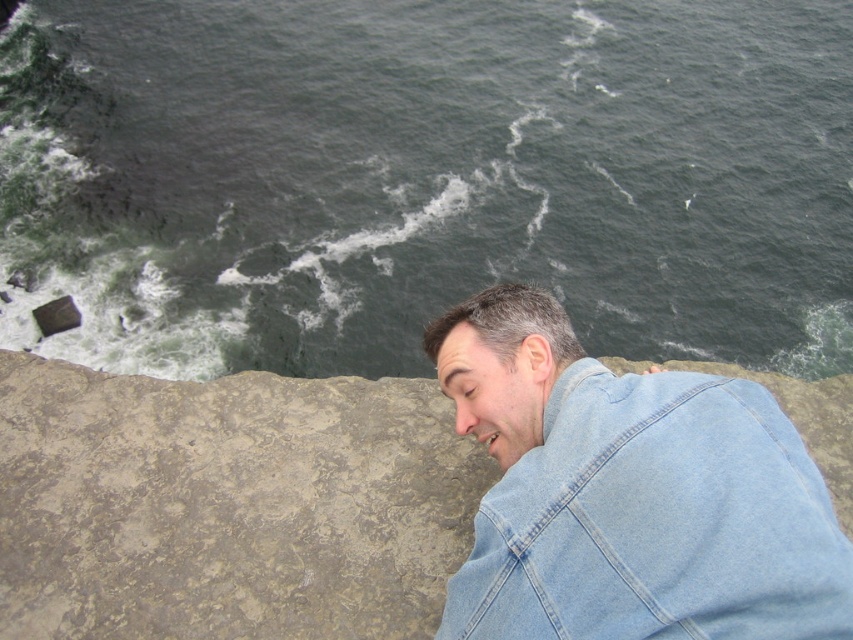
You are a drone operator tasked with capturing aerial footage of the dark green water at upper left and the gray stone cliff at lower right. The drone has a maximum flight range of 25 meters. Can the drone safely capture footage of both locations without exceeding its range?

The dark green water at upper left and gray stone cliff at lower right are 25.67 meters apart. Since the drone has a maximum flight range of 25 meters, it cannot safely capture footage of both locations without exceeding its range.